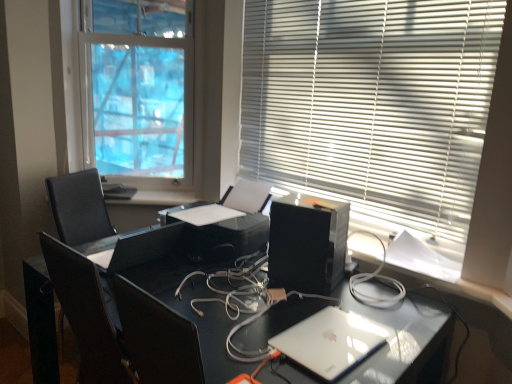
You are a GUI agent. You are given a task and a screenshot of the screen. Output one action in this format:
    pyautogui.click(x=<x>, y=<y>)
    Task: Click on the vacant area to the right of black plastic desktop computer at center
    The width and height of the screenshot is (512, 384).
    Given the screenshot: What is the action you would take?
    pyautogui.click(x=364, y=290)